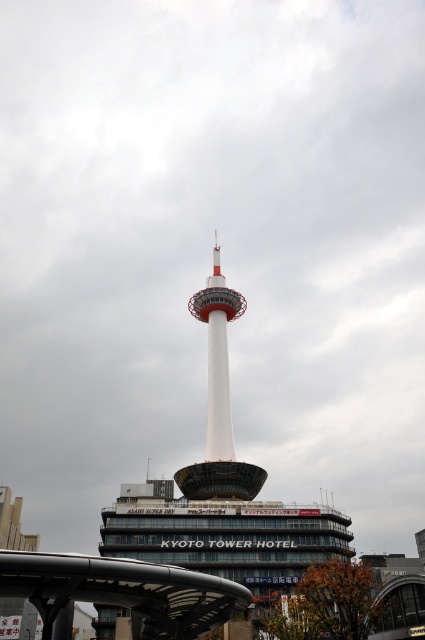
Question: From the image, what is the correct spatial relationship of white smooth tower at center in relation to white glossy tower at center?

Choices:
 (A) above
 (B) below

Answer: (B)

Question: Which point appears farthest from the camera in this image?

Choices:
 (A) (201, 502)
 (B) (184, 490)

Answer: (B)

Question: Which object is closer to the camera taking this photo?

Choices:
 (A) white smooth tower at center
 (B) white glossy tower at center

Answer: (A)

Question: Observing the image, what is the correct spatial positioning of white smooth tower at center in reference to white glossy tower at center?

Choices:
 (A) above
 (B) below

Answer: (B)

Question: In this image, where is white smooth tower at center located relative to white glossy tower at center?

Choices:
 (A) above
 (B) below

Answer: (B)